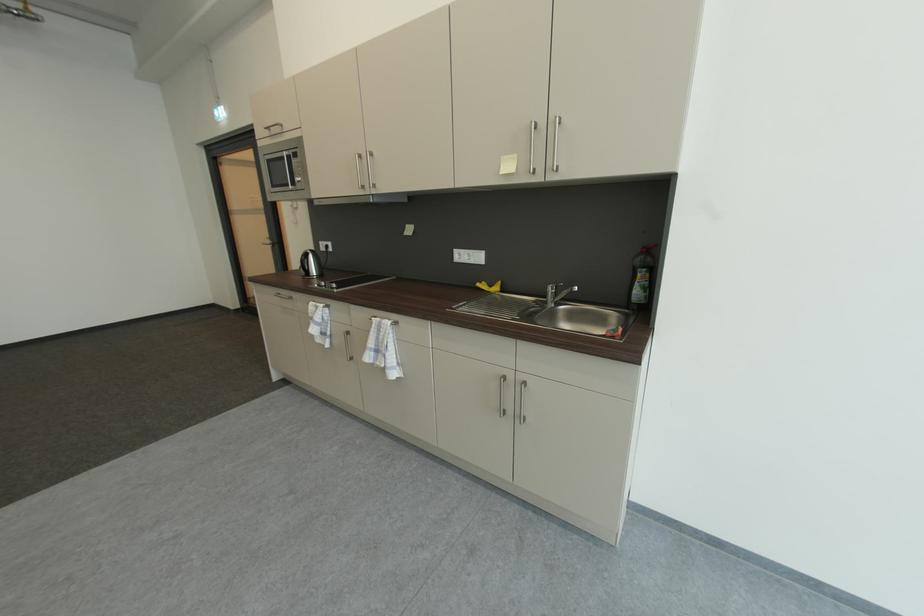
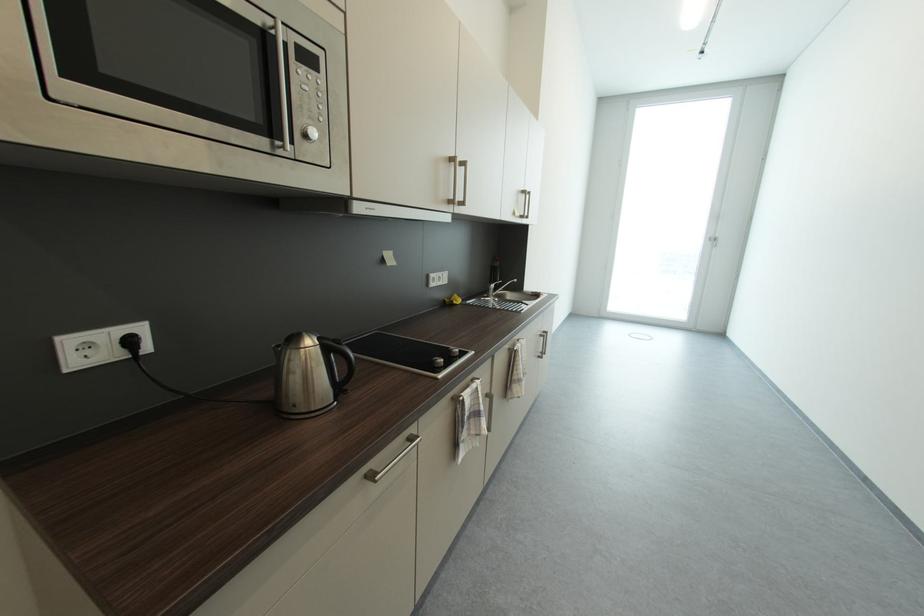
Locate, in the second image, the point that corresponds to point (487, 284) in the first image.

(453, 302)